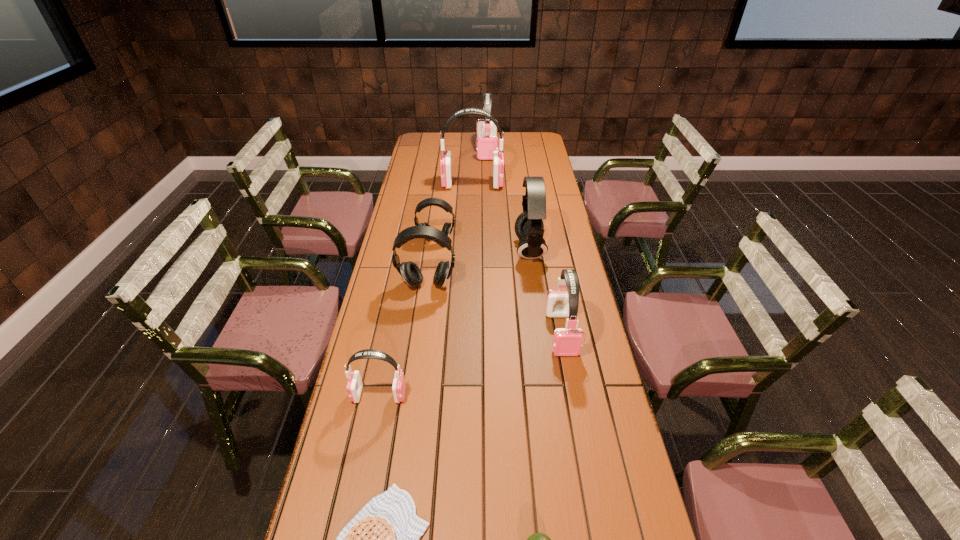
Find the location of a particular element. This screenshot has width=960, height=540. vacant region that satisfies the following two spatial constraints: 1. on the outer surface of the second farthest object; 2. on the ear cups of the fifth nearest object is located at coordinates point(470,285).

The width and height of the screenshot is (960, 540). Find the location of `blank space that satisfies the following two spatial constraints: 1. on the outer surface of the tallest object; 2. on the ear cups of the smallest black earphone`. blank space that satisfies the following two spatial constraints: 1. on the outer surface of the tallest object; 2. on the ear cups of the smallest black earphone is located at coordinates (471, 239).

Where is `vacant space that satisfies the following two spatial constraints: 1. on the ear cups of the fifth farthest object; 2. on the outer surface of the leftmost pink earphone`? vacant space that satisfies the following two spatial constraints: 1. on the ear cups of the fifth farthest object; 2. on the outer surface of the leftmost pink earphone is located at coordinates (412, 395).